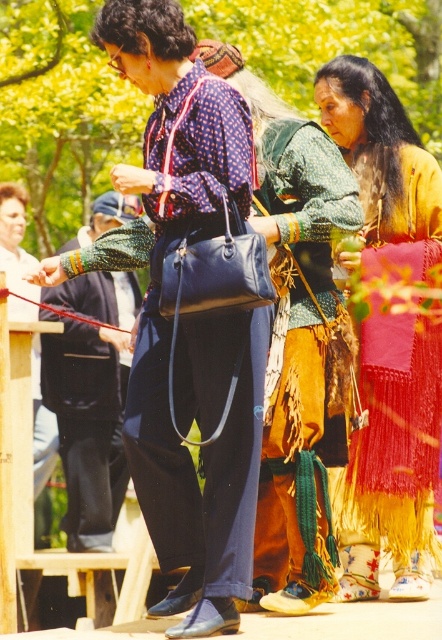
Question: Does textured brown leather vest at center appear on the right side of green woven fabric at center?

Choices:
 (A) no
 (B) yes

Answer: (B)

Question: Which object is farther from the camera taking this photo?

Choices:
 (A) knitted wool skirt at center
 (B) textured brown leather vest at center
 (C) green woven fabric at center

Answer: (C)

Question: Does knitted wool skirt at center have a greater width compared to green woven fabric at center?

Choices:
 (A) yes
 (B) no

Answer: (B)

Question: Estimate the real-world distances between objects in this image. Which object is closer to the textured brown leather vest at center?

Choices:
 (A) knitted wool skirt at center
 (B) green woven fabric at center

Answer: (A)

Question: Is textured brown leather vest at center bigger than green woven fabric at center?

Choices:
 (A) yes
 (B) no

Answer: (B)

Question: Among these objects, which one is farthest from the camera?

Choices:
 (A) knitted wool skirt at center
 (B) textured brown leather vest at center

Answer: (A)